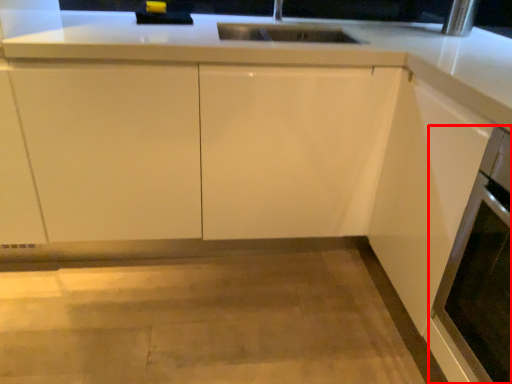
Question: From the image's perspective, what is the correct spatial positioning of oven (annotated by the red box) in reference to cabinetry?

Choices:
 (A) below
 (B) above

Answer: (A)